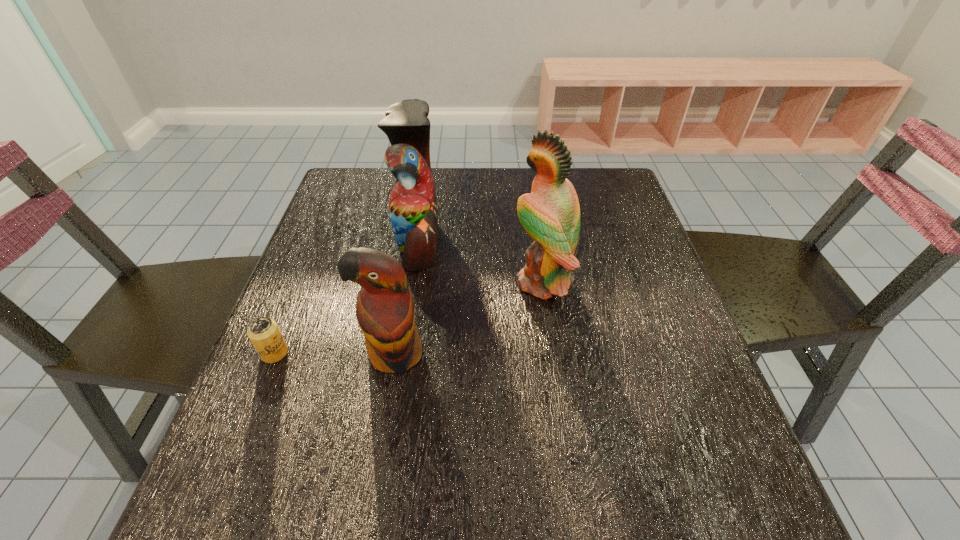
In the image, there is a desktop. Where is `vacant space at the near edge`? Image resolution: width=960 pixels, height=540 pixels. vacant space at the near edge is located at coordinates (575, 485).

The image size is (960, 540). I want to click on vacant area at the left edge of the desktop, so click(350, 247).

The width and height of the screenshot is (960, 540). What are the coordinates of `free space at the right edge of the desktop` in the screenshot? It's located at (625, 335).

In order to click on free space at the far left corner of the desktop in this screenshot , I will do `click(390, 183)`.

What are the coordinates of `vacant space at the near left corner of the desktop` in the screenshot? It's located at (261, 477).

In the image, there is a desktop. Where is `vacant area at the near right corner`? vacant area at the near right corner is located at coordinates (669, 478).

Image resolution: width=960 pixels, height=540 pixels. Find the location of `vacant space in between the nearest parrot and the rightmost object`. vacant space in between the nearest parrot and the rightmost object is located at coordinates (468, 318).

This screenshot has height=540, width=960. I want to click on free space between the rightmost object and the nearest parrot, so click(468, 318).

Locate an element on the screen. Image resolution: width=960 pixels, height=540 pixels. blank region between the nearest parrot and the rightmost parrot is located at coordinates (468, 318).

You are a GUI agent. You are given a task and a screenshot of the screen. Output one action in this format:
    pyautogui.click(x=<x>, y=<y>)
    Task: Click on the free space between the nearest parrot and the beer can
    The width and height of the screenshot is (960, 540).
    Given the screenshot: What is the action you would take?
    pyautogui.click(x=334, y=353)